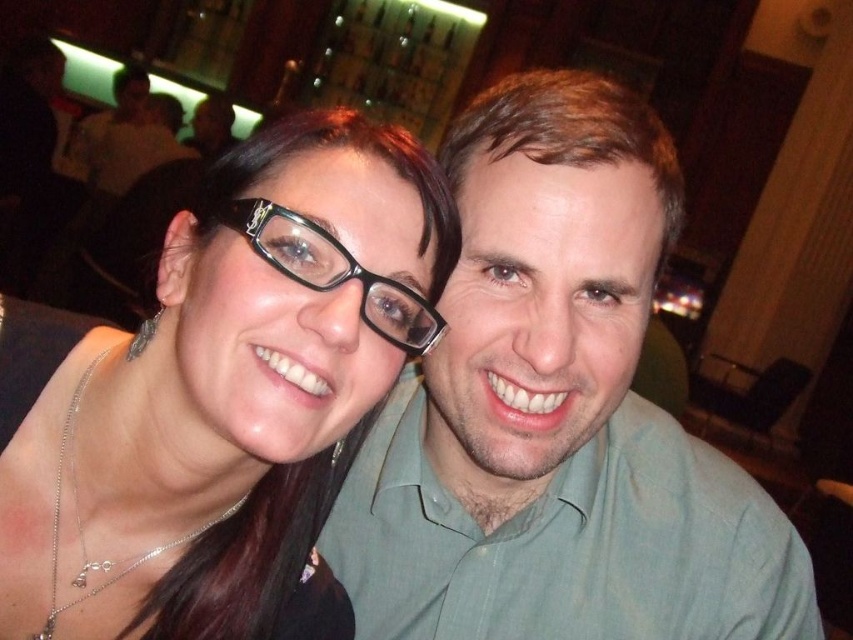
You are standing in the scene and want to locate the green textured shirt at center. What are its coordinates?

The green textured shirt at center is located at coordinates (556, 413).

You are trying to find the matte black glasses at upper left in the image. Based on the scene description, where should you look?

The matte black glasses at upper left is located at point (x=219, y=396) in the image.